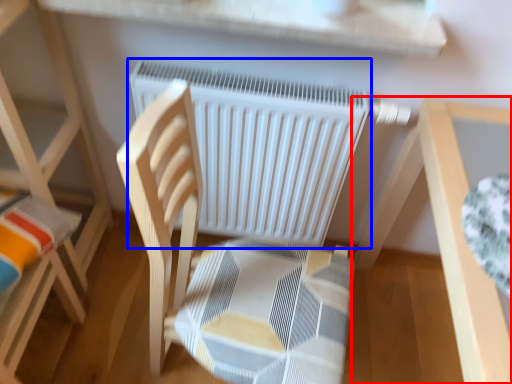
Question: Which point is further to the camera, table (highlighted by a red box) or radiator (highlighted by a blue box)?

Choices:
 (A) table
 (B) radiator

Answer: (B)